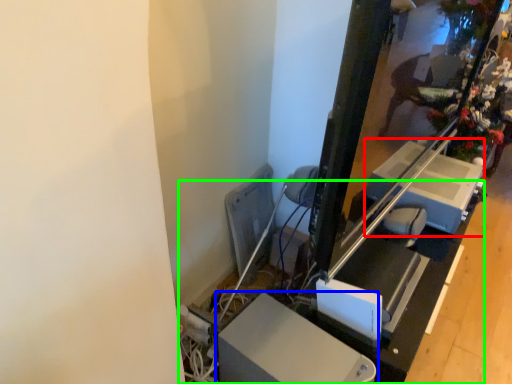
Question: Based on their relative distances, which object is nearer to lift (highlighted by a red box)? Choose from furniture (highlighted by a blue box) and table (highlighted by a green box).

Choices:
 (A) furniture
 (B) table

Answer: (B)